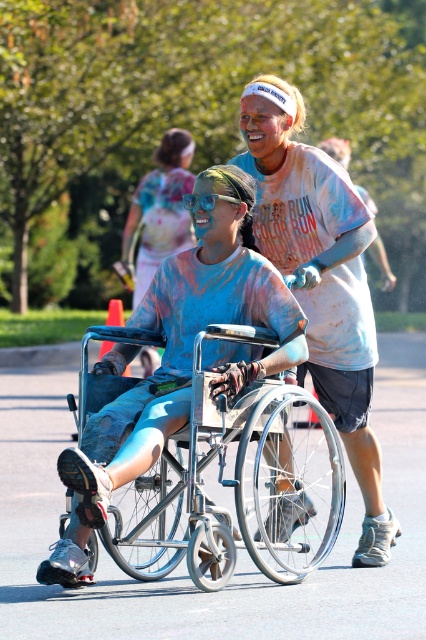
You are a photographer at the Color Run event. You want to capture a photo where the white cotton shirt at upper center and the blue painted skin at center are both visible. Which object should you focus on to ensure both are in frame?

The white cotton shirt at upper center is smaller than the blue painted skin at center, so focusing on the blue painted skin at center would ensure both are visible in the frame.